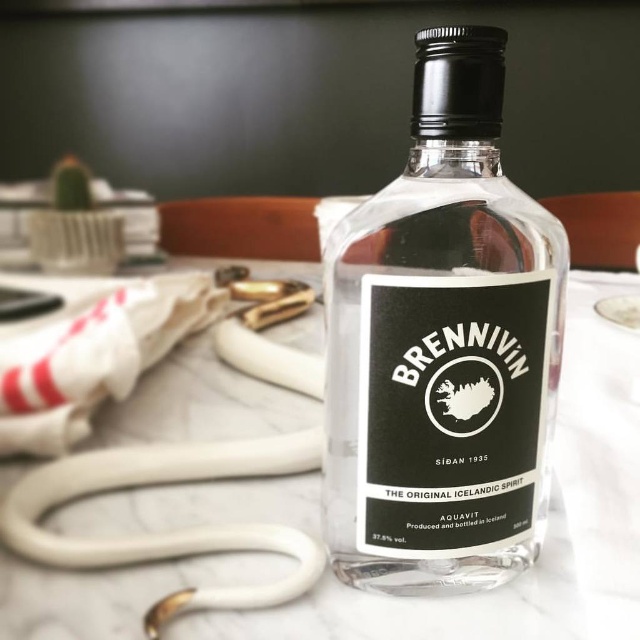
Question: Does transparent glass bottle at center come behind white marble table at center?

Choices:
 (A) yes
 (B) no

Answer: (B)

Question: Is transparent glass bottle at center closer to the viewer compared to white marble table at center?

Choices:
 (A) no
 (B) yes

Answer: (B)

Question: In this image, where is transparent glass bottle at center located relative to white marble table at center?

Choices:
 (A) right
 (B) left

Answer: (A)

Question: Which object is closer to the camera taking this photo?

Choices:
 (A) transparent glass bottle at center
 (B) white marble table at center

Answer: (A)

Question: Which of the following is the farthest from the observer?

Choices:
 (A) (349, 372)
 (B) (156, 428)

Answer: (B)

Question: Among these objects, which one is farthest from the camera?

Choices:
 (A) transparent glass bottle at center
 (B) white marble table at center

Answer: (B)